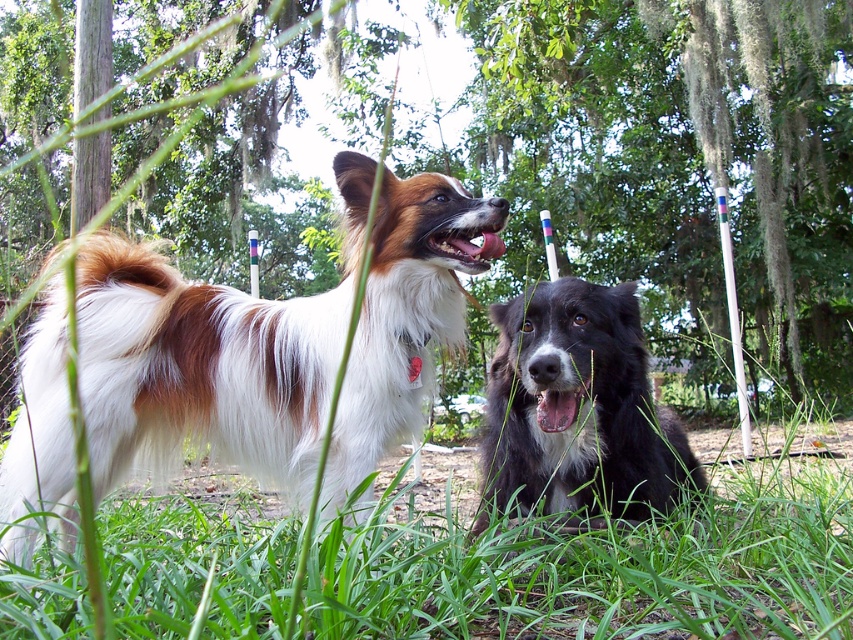
Question: Observing the image, what is the correct spatial positioning of green leafy tree at upper center in reference to white and brown fur dog at left?

Choices:
 (A) left
 (B) right

Answer: (A)

Question: Is the position of green grass at lower center more distant than that of black fluffy dog at center?

Choices:
 (A) yes
 (B) no

Answer: (B)

Question: Can you confirm if green leafy tree at upper center is positioned to the left of black fluffy dog at center?

Choices:
 (A) no
 (B) yes

Answer: (B)

Question: Which point is closer to the camera taking this photo?

Choices:
 (A) (641, 388)
 (B) (490, 148)
 (C) (740, 529)

Answer: (C)

Question: Which of the following is the farthest from the observer?

Choices:
 (A) black fluffy dog at center
 (B) green leafy tree at upper center
 (C) white and brown fur dog at left
 (D) green grass at lower center

Answer: (B)

Question: Which point is closer to the camera taking this photo?

Choices:
 (A) (837, 100)
 (B) (352, 364)

Answer: (B)